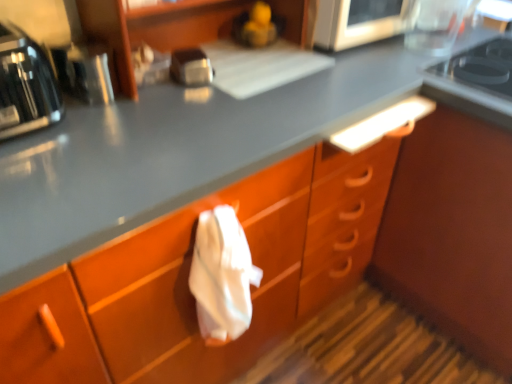
Where is `unoccupied space behind satin silver toaster at upper center`? unoccupied space behind satin silver toaster at upper center is located at coordinates (215, 58).